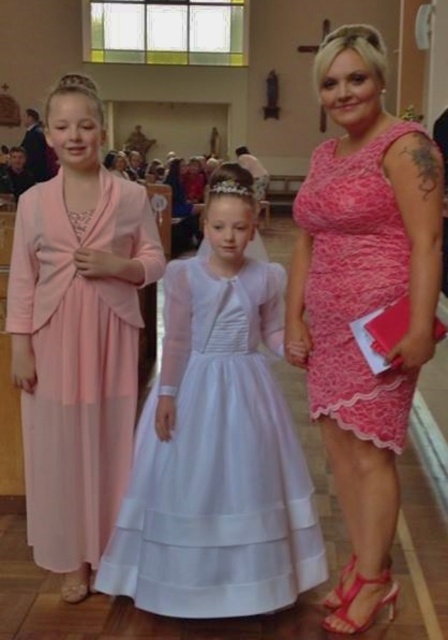
Question: Is pink lace dress at center below pink lace dress at right?

Choices:
 (A) no
 (B) yes

Answer: (B)

Question: Based on their relative distances, which object is nearer to the white satin dress at center?

Choices:
 (A) pink lace dress at right
 (B) pink lace dress at center

Answer: (B)

Question: Among these points, which one is nearest to the camera?

Choices:
 (A) (317, 259)
 (B) (30, 252)

Answer: (A)

Question: Which is nearer to the matte pink dress at left?

Choices:
 (A) white satin dress at center
 (B) pink lace dress at right
 (C) pink lace dress at center

Answer: (A)

Question: Does pink lace dress at center appear on the right side of matte pink dress at left?

Choices:
 (A) yes
 (B) no

Answer: (A)

Question: Does pink lace dress at center have a larger size compared to white satin dress at center?

Choices:
 (A) no
 (B) yes

Answer: (B)